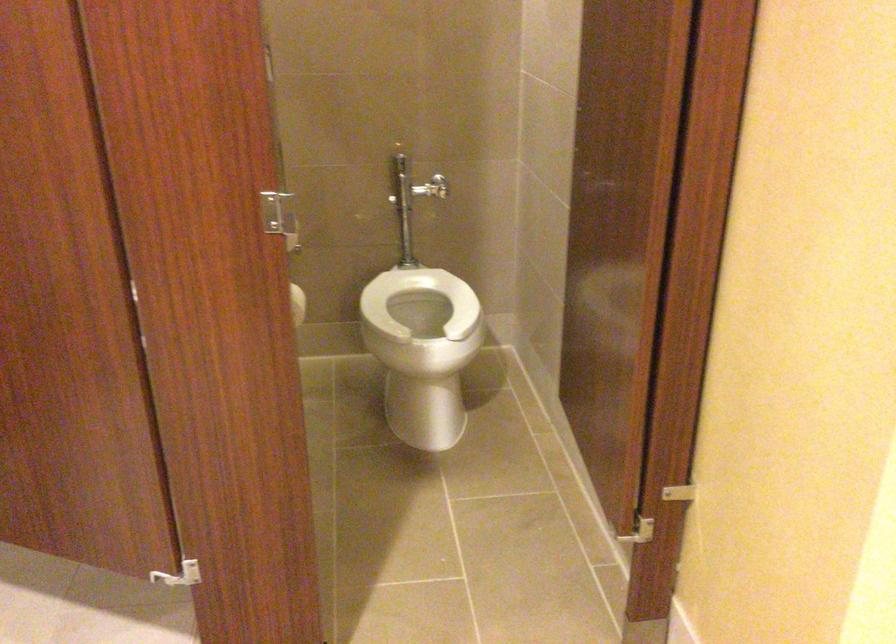
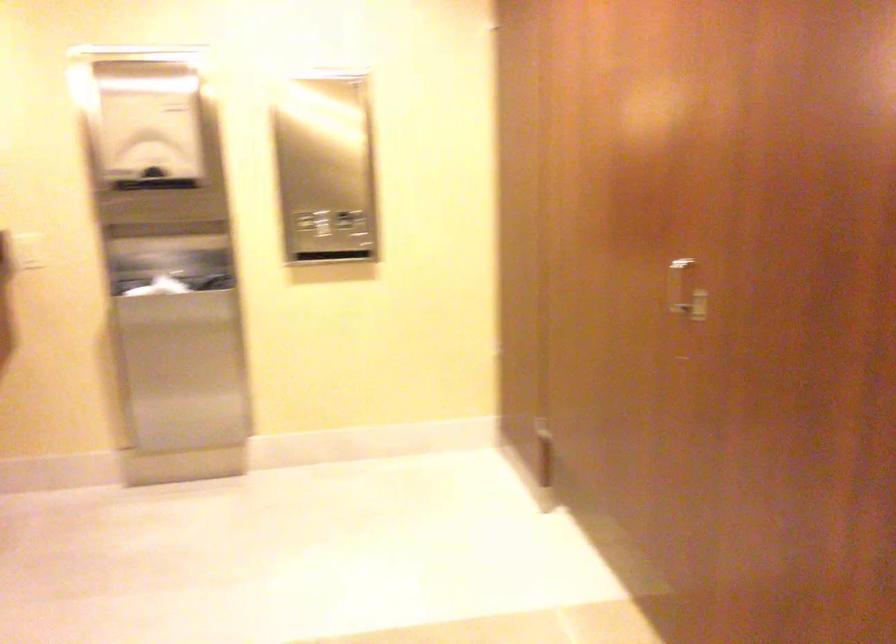
Question: Based on the continuous images, in which direction is the camera rotating? Reply with the corresponding letter.

Choices:
 (A) Left
 (B) Right
 (C) Up
 (D) Down

Answer: (A)